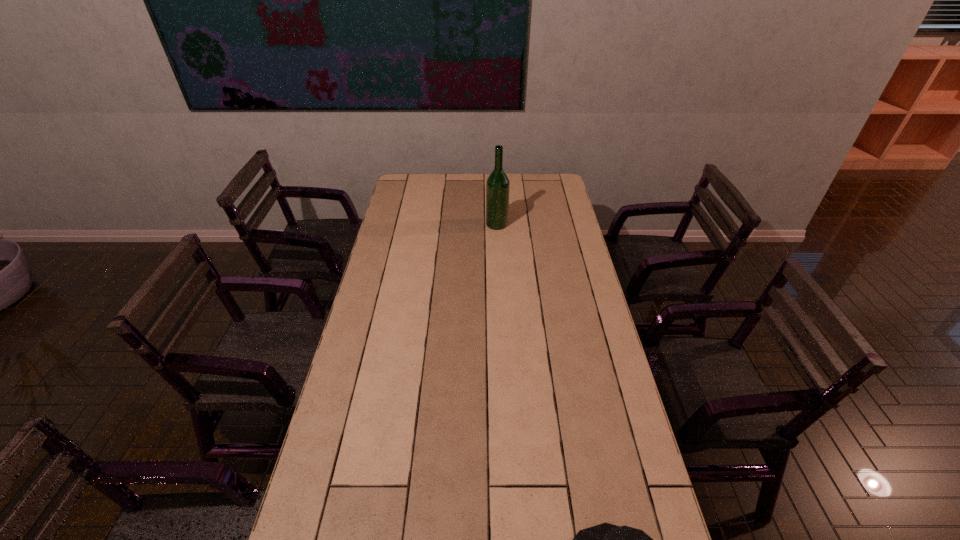
You are a GUI agent. You are given a task and a screenshot of the screen. Output one action in this format:
    pyautogui.click(x=<x>, y=<y>)
    Task: Click on the alcohol
    This screenshot has height=540, width=960.
    Given the screenshot: What is the action you would take?
    pyautogui.click(x=497, y=185)

The height and width of the screenshot is (540, 960). What are the coordinates of `the left object` in the screenshot? It's located at (497, 185).

I want to click on vacant space situated 0.220m on the front of the farther object, so click(x=498, y=260).

Locate an element on the screen. vacant space at the far edge of the desktop is located at coordinates (531, 177).

Find the location of a particular element. vacant area at the left edge is located at coordinates (383, 405).

This screenshot has height=540, width=960. Identify the location of vacant space at the right edge of the desktop. (610, 434).

In the image, there is a desktop. Identify the location of vacant space at the far left corner. Image resolution: width=960 pixels, height=540 pixels. (399, 188).